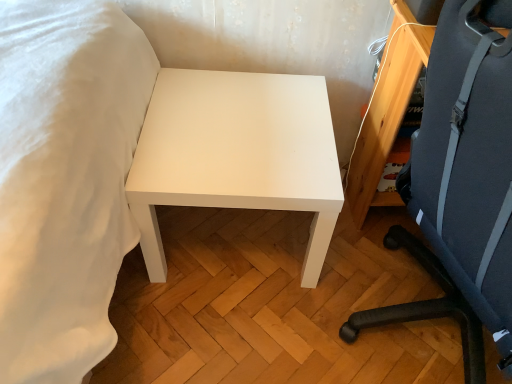
Question: Visually, is white matte table at center positioned to the left or to the right of dark blue fabric chair at right?

Choices:
 (A) left
 (B) right

Answer: (A)

Question: Considering the positions of white matte table at center and dark blue fabric chair at right in the image, is white matte table at center taller or shorter than dark blue fabric chair at right?

Choices:
 (A) tall
 (B) short

Answer: (B)

Question: Is white matte table at center wider or thinner than dark blue fabric chair at right?

Choices:
 (A) thin
 (B) wide

Answer: (A)

Question: Is dark blue fabric chair at right in front of or behind white matte table at center in the image?

Choices:
 (A) front
 (B) behind

Answer: (A)

Question: Considering the positions of dark blue fabric chair at right and white matte table at center in the image, is dark blue fabric chair at right taller or shorter than white matte table at center?

Choices:
 (A) tall
 (B) short

Answer: (A)

Question: Is point (475, 87) positioned closer to the camera than point (318, 192)?

Choices:
 (A) farther
 (B) closer

Answer: (B)

Question: From a real-world perspective, is dark blue fabric chair at right positioned above or below white matte table at center?

Choices:
 (A) below
 (B) above

Answer: (B)